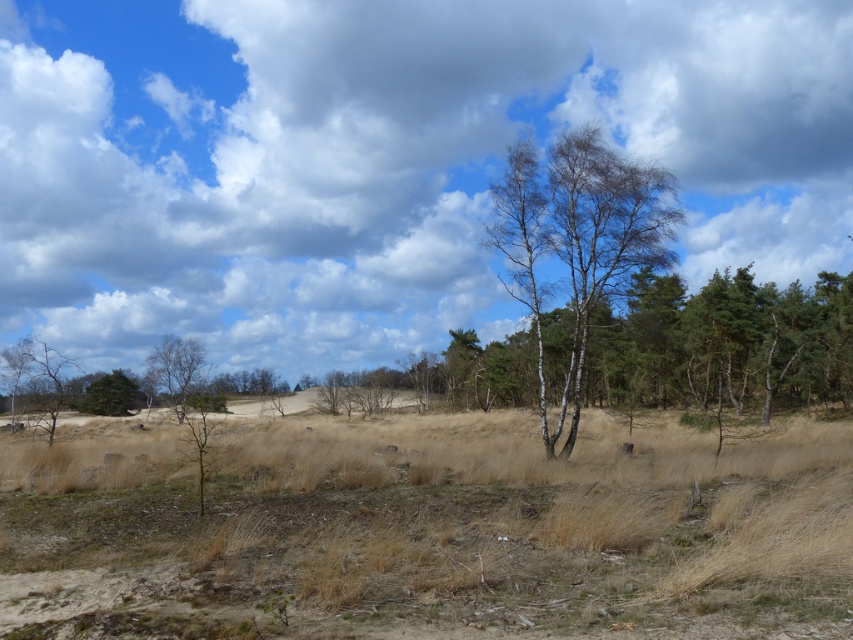
Is white fluffy cloud at upper center above green matte tree at lower left?

Yes, white fluffy cloud at upper center is above green matte tree at lower left.

Looking at this image, which is more to the left, white fluffy cloud at upper center or green matte tree at lower left?

From the viewer's perspective, green matte tree at lower left appears more on the left side.

Does point (357, 76) come behind point (125, 380)?

That is True.

The image size is (853, 640). What are the coordinates of `white fluffy cloud at upper center` in the screenshot? It's located at (381, 160).

Does white fluffy cloud at upper center have a lesser width compared to bare birch trees at center?

No.

Which is behind, point (390, 244) or point (606, 212)?

The point (390, 244) is more distant.

The width and height of the screenshot is (853, 640). What are the coordinates of `white fluffy cloud at upper center` in the screenshot? It's located at pyautogui.click(x=381, y=160).

Is point (614, 211) positioned in front of point (117, 406)?

Yes, it is in front of point (117, 406).

The height and width of the screenshot is (640, 853). Find the location of `bare birch trees at center`. bare birch trees at center is located at coordinates (577, 243).